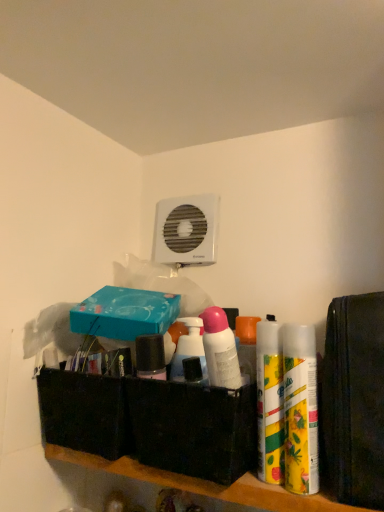
Question: Is yellow matte can at right, which is the 2th cleaning product in left-to-right order, wider or thinner than black fabric basket at center, marked as the second box in a top-to-bottom arrangement?

Choices:
 (A) wide
 (B) thin

Answer: (B)

Question: Is yellow matte can at right, which is the 2th cleaning product in left-to-right order, in front of or behind black fabric basket at center, marked as the second box in a top-to-bottom arrangement, in the image?

Choices:
 (A) behind
 (B) front

Answer: (A)

Question: Estimate the real-world distances between objects in this image. Which object is closer to the pink plastic spray bottle at center, marked as the first cleaning product in a left-to-right arrangement?

Choices:
 (A) yellow matte spray can at right, which ranks as the first cleaning product in right-to-left order
 (B) black fabric basket at center, which is the 1th box in bottom-to-top order
 (C) yellow matte can at right, acting as the 2th cleaning product starting from the right
 (D) teal matte box at upper center, the 1th box when ordered from top to bottom

Answer: (C)

Question: Considering the real-world distances, which object is farthest from the yellow matte can at right, acting as the 2th cleaning product starting from the right?

Choices:
 (A) yellow matte spray can at right, which ranks as the 3th cleaning product in left-to-right order
 (B) teal matte box at upper center, arranged as the second box when ordered from the bottom
 (C) pink plastic spray bottle at center, which ranks as the third cleaning product in right-to-left order
 (D) black fabric basket at center, which is the 1th box in bottom-to-top order

Answer: (B)